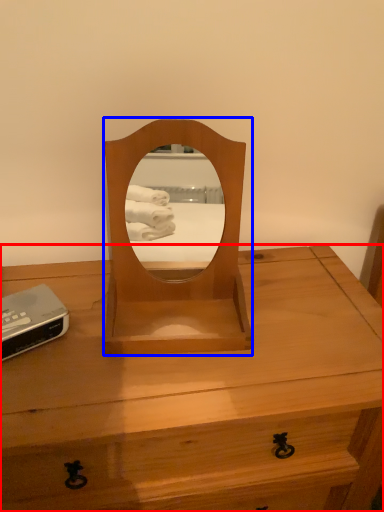
Question: Which object is further to the camera taking this photo, desk (highlighted by a red box) or mirror (highlighted by a blue box)?

Choices:
 (A) desk
 (B) mirror

Answer: (B)